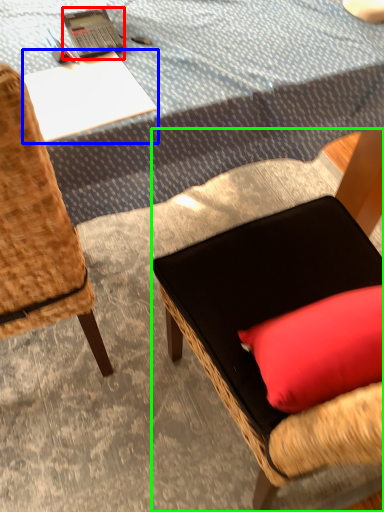
Question: Considering the real-world distances, which object is farthest from laptop (highlighted by a red box)? desk (highlighted by a blue box) or chair (highlighted by a green box)?

Choices:
 (A) desk
 (B) chair

Answer: (B)